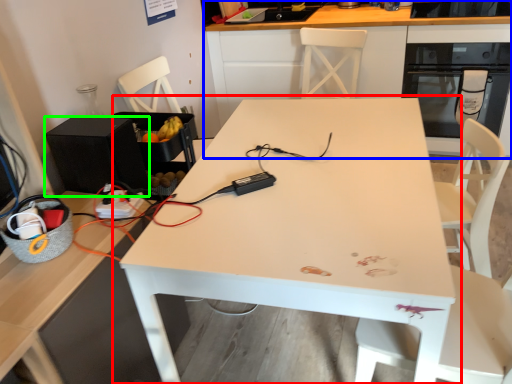
Question: Which object is positioned farthest from table (highlighted by a red box)? Select from cabinetry (highlighted by a blue box) and appliance (highlighted by a green box).

Choices:
 (A) cabinetry
 (B) appliance

Answer: (A)